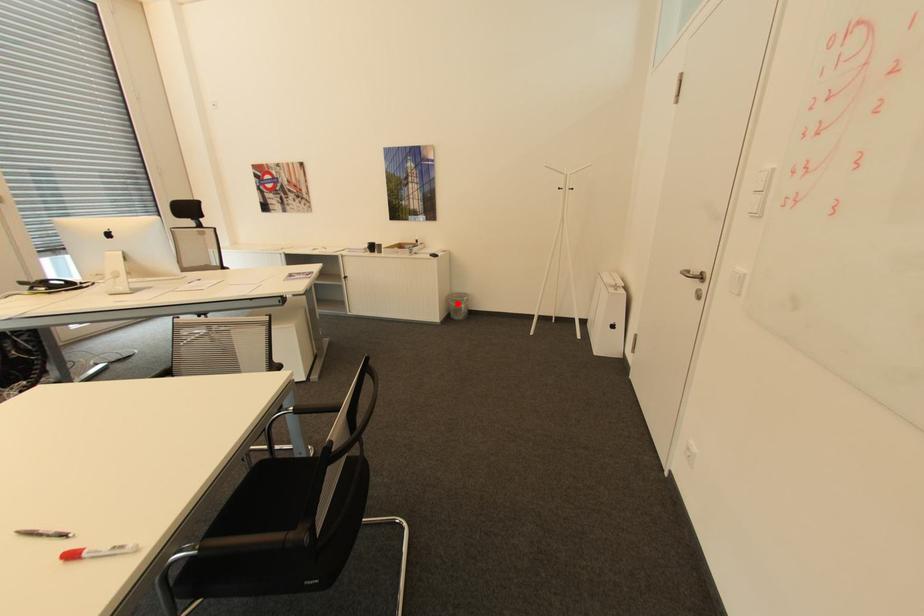
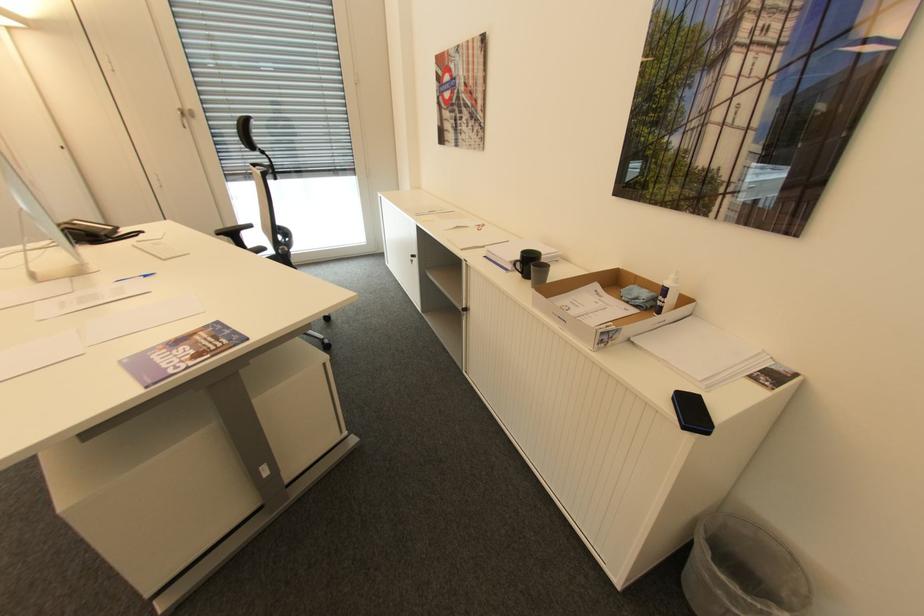
Locate, in the second image, the point that corresponds to the highlighted location in the first image.

(711, 576)